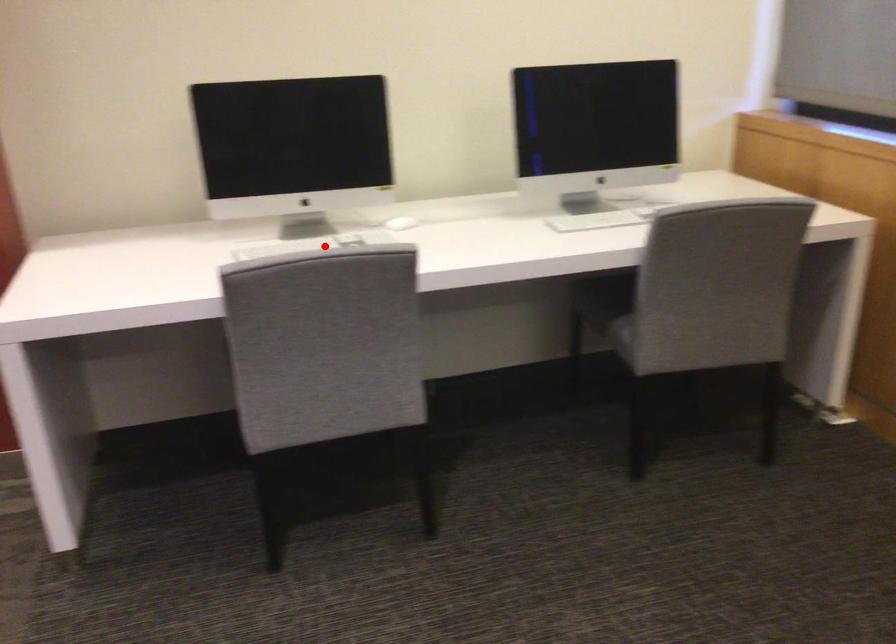
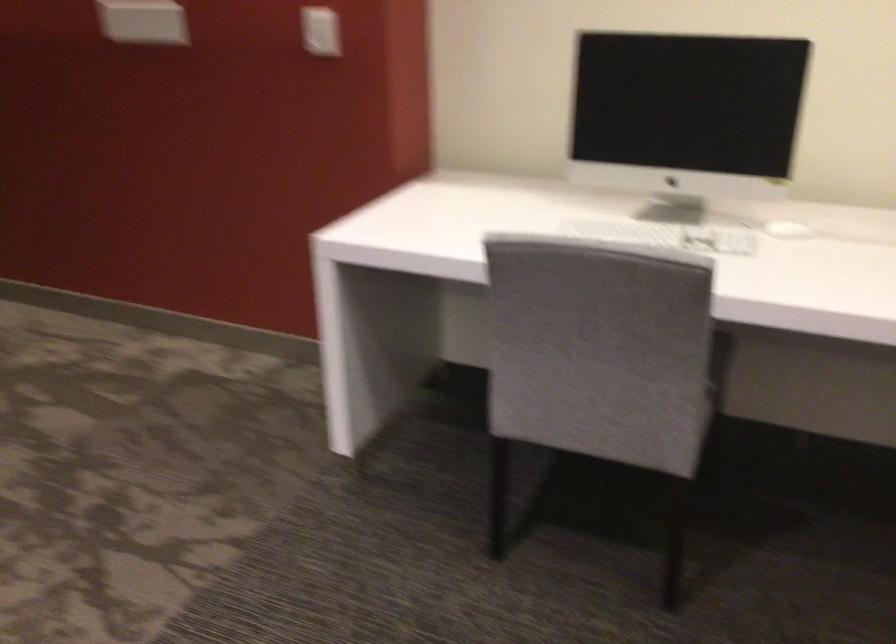
Question: I am providing you with two images of the same scene from different viewpoints. In image1, a red point is highlighted. Considering the same 3D point in image2, which of the following is correct?

Choices:
 (A) It is closer
 (B) It is farther

Answer: (A)